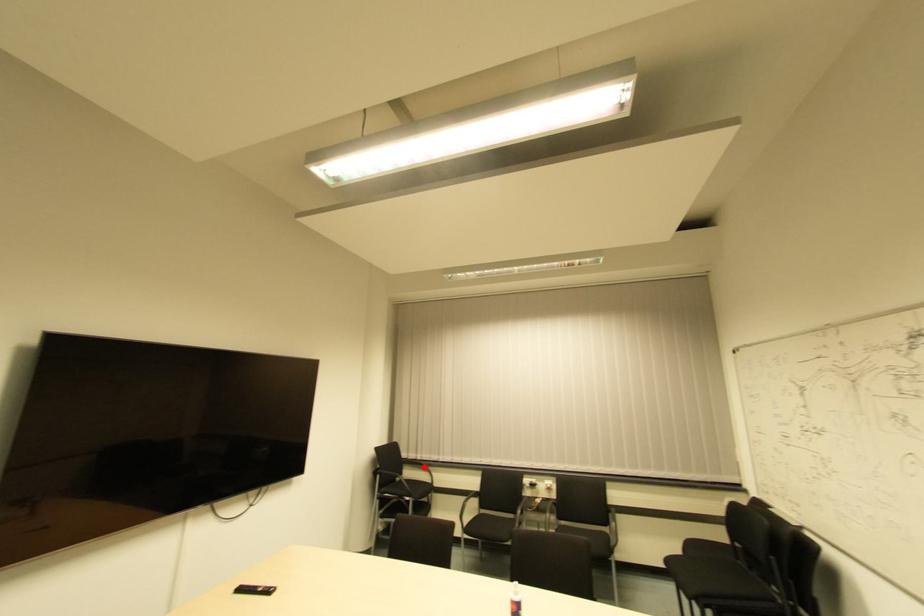
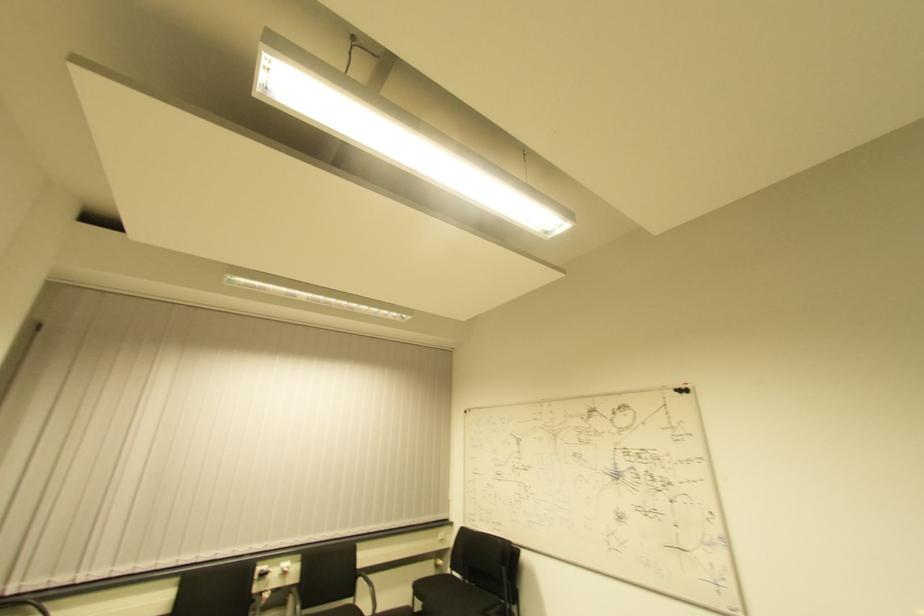
In the second image, find the point that corresponds to the highlighted location in the first image.

(37, 601)